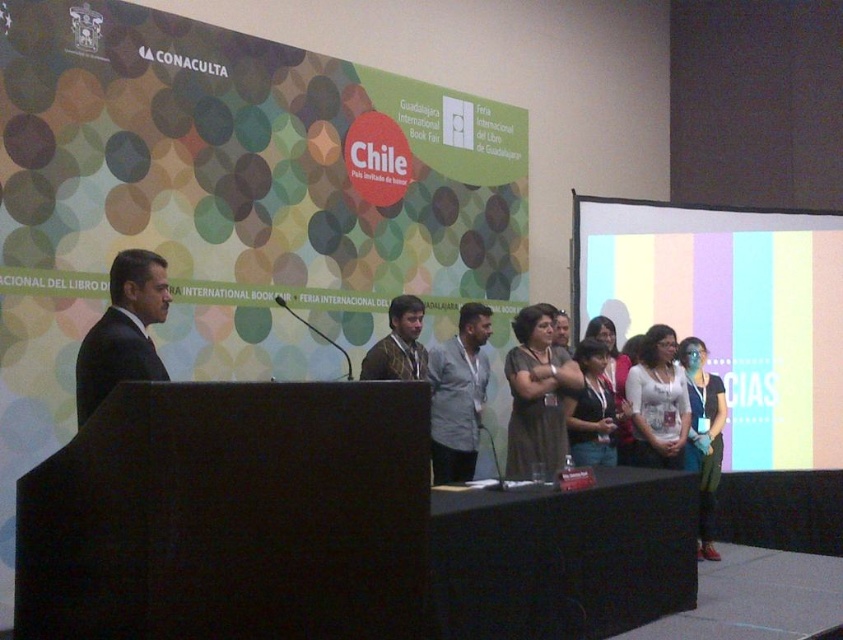
Question: Is black suit at left wider than matte black jacket at lower right?

Choices:
 (A) no
 (B) yes

Answer: (A)

Question: Does pastel striped fabric at right come in front of matte black dress at center?

Choices:
 (A) no
 (B) yes

Answer: (A)

Question: Which of the following is the farthest from the observer?

Choices:
 (A) (717, 554)
 (B) (471, 365)
 (C) (385, 372)
 (D) (507, 358)

Answer: (A)

Question: Which object is closer to the camera taking this photo?

Choices:
 (A) white matte blouse at center
 (B) matte black jacket at lower right
 (C) shiny brown suit at center
 (D) matte black dress at center

Answer: (C)

Question: Is black suit at left to the left of light gray shirt at center from the viewer's perspective?

Choices:
 (A) no
 (B) yes

Answer: (B)

Question: Which point appears farthest from the camera in this image?

Choices:
 (A) (722, 388)
 (B) (685, 330)

Answer: (B)